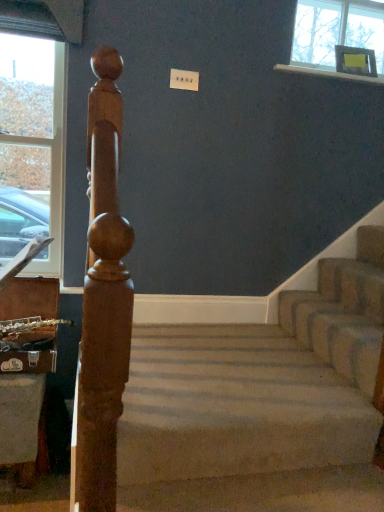
Question: From the image's perspective, does beige carpeted stairs at center appear lower than clear glass window at left?

Choices:
 (A) no
 (B) yes

Answer: (B)

Question: Does beige carpeted stairs at center appear on the right side of clear glass window at left?

Choices:
 (A) no
 (B) yes

Answer: (B)

Question: Can you confirm if beige carpeted stairs at center is bigger than clear glass window at left?

Choices:
 (A) yes
 (B) no

Answer: (A)

Question: Is beige carpeted stairs at center at the left side of clear glass window at left?

Choices:
 (A) yes
 (B) no

Answer: (B)

Question: Is clear glass window at left at the back of beige carpeted stairs at center?

Choices:
 (A) yes
 (B) no

Answer: (B)

Question: From a real-world perspective, is beige carpeted stairs at center located higher than clear glass window at left?

Choices:
 (A) yes
 (B) no

Answer: (B)

Question: Can we say polished wood post at left lies outside clear glass window at left?

Choices:
 (A) yes
 (B) no

Answer: (A)

Question: Can you confirm if polished wood post at left is shorter than clear glass window at left?

Choices:
 (A) yes
 (B) no

Answer: (B)

Question: Can you confirm if polished wood post at left is wider than clear glass window at left?

Choices:
 (A) yes
 (B) no

Answer: (A)

Question: From the image's perspective, does polished wood post at left appear lower than clear glass window at left?

Choices:
 (A) yes
 (B) no

Answer: (A)

Question: Does polished wood post at left have a smaller size compared to clear glass window at left?

Choices:
 (A) yes
 (B) no

Answer: (B)

Question: Is polished wood post at left closer to camera compared to clear glass window at left?

Choices:
 (A) yes
 (B) no

Answer: (A)

Question: Would you say beige carpeted stairs at center is part of white glossy window sill at upper right's contents?

Choices:
 (A) yes
 (B) no

Answer: (B)